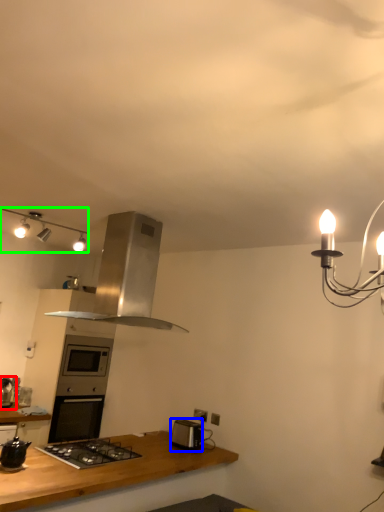
Question: Which object is the closest to the appliance (highlighted by a red box)? Choose among these: toaster (highlighted by a blue box) or lamp (highlighted by a green box).

Choices:
 (A) toaster
 (B) lamp

Answer: (B)